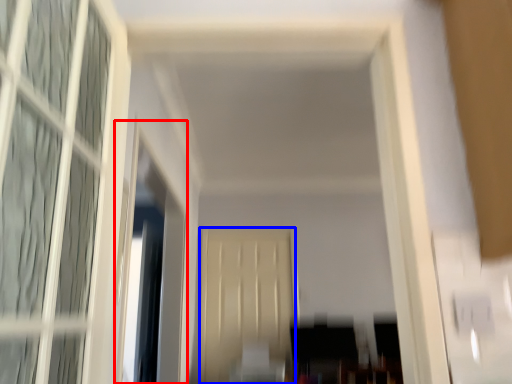
Question: Which object is closer to the camera taking this photo, window screen (highlighted by a red box) or screen door (highlighted by a blue box)?

Choices:
 (A) window screen
 (B) screen door

Answer: (A)